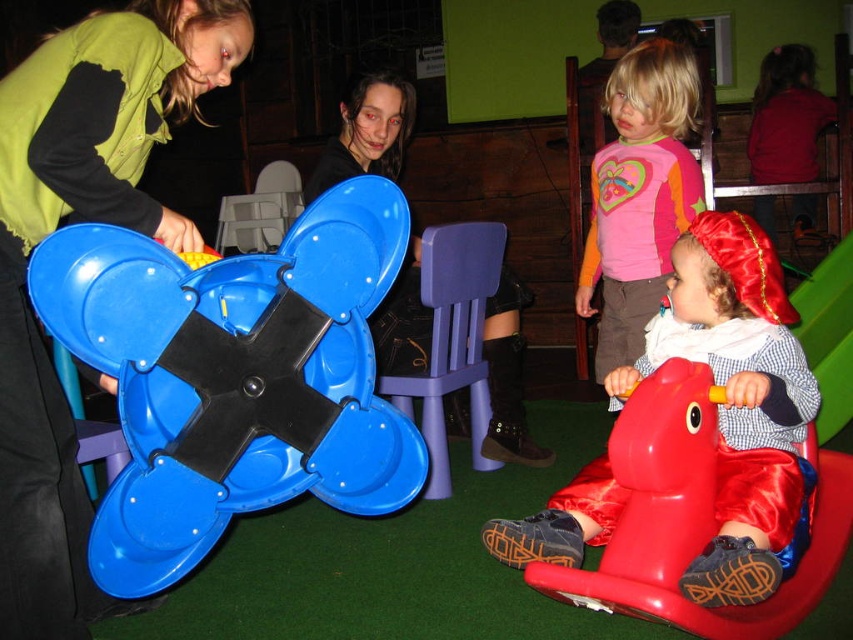
You are a photographer setting up for a group photo. You need to ensure that the pink fabric shirt at upper center and the matte black chair at center are both visible in the frame. Given their sizes, which object should you focus on to ensure both are captured clearly?

The pink fabric shirt at upper center is bigger than the matte black chair at center, so focusing on the pink fabric shirt at upper center would help ensure both objects are visible in the frame since it takes up more space.

You are a parent looking for your child who is sitting on a ride on toy. You see the rubberized plastic rocking horse at lower right at point (692, 516). Where should you look to find your child?

The rubberized plastic rocking horse at lower right is located at point (692, 516), so you should look at that location to find your child.